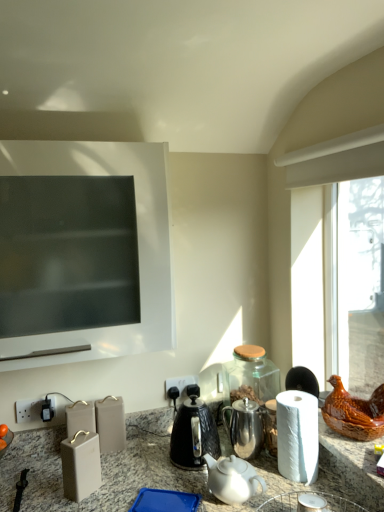
Measure the distance between white ceramic teapot at center and camera.

white ceramic teapot at center is 4.27 feet away from camera.

In order to click on matte gray knife block at center in this screenshot , I will do `click(81, 465)`.

Describe the element at coordinates (81, 465) in the screenshot. I see `matte gray knife block at center` at that location.

You are a GUI agent. You are given a task and a screenshot of the screen. Output one action in this format:
    pyautogui.click(x=<x>, y=<y>)
    Task: Click on the black textured kettle at center
    Image resolution: width=384 pixels, height=512 pixels.
    Given the screenshot: What is the action you would take?
    pyautogui.click(x=192, y=431)

This screenshot has width=384, height=512. What are the coordinates of `white paper at right` in the screenshot? It's located at (297, 436).

This screenshot has height=512, width=384. Describe the element at coordinates (297, 436) in the screenshot. I see `white paper at right` at that location.

Where is `shiny metallic teapot at center`? The image size is (384, 512). shiny metallic teapot at center is located at coordinates 245,426.

The image size is (384, 512). Identify the location of white ceramic teapot at center. (233, 479).

Between white ceramic teapot at center and shiny metallic teapot at center, which one has smaller width?

shiny metallic teapot at center.

From a real-world perspective, is white ceramic teapot at center over shiny metallic teapot at center?

No, from a real-world perspective, white ceramic teapot at center is not above shiny metallic teapot at center.

Looking at this image, is white ceramic teapot at center far away from shiny metallic teapot at center?

No, there isn't a large distance between white ceramic teapot at center and shiny metallic teapot at center.

Is shiny metallic teapot at center thinner than white ceramic teapot at center?

Correct, the width of shiny metallic teapot at center is less than that of white ceramic teapot at center.

Are shiny metallic teapot at center and white ceramic teapot at center far apart?

shiny metallic teapot at center is near white ceramic teapot at center, not far away.

Considering the positions of point (236, 451) and point (243, 499), is point (236, 451) closer or farther from the camera than point (243, 499)?

Point (236, 451) is farther from the camera than point (243, 499).

Which object is thinner, black plastic electric outlet at lower center or matte gray knife block at center?

With smaller width is black plastic electric outlet at lower center.

Locate an element on the screen. appliance directly beneath the black plastic electric outlet at lower center (from a real-world perspective) is located at coordinates (81, 465).

Considering the relative sizes of black plastic electric outlet at lower center and matte gray knife block at center in the image provided, is black plastic electric outlet at lower center taller than matte gray knife block at center?

Incorrect, the height of black plastic electric outlet at lower center is not larger of that of matte gray knife block at center.

Could you tell me if black plastic electric outlet at lower center is turned towards matte gray knife block at center?

No.

In the scene shown: Considering the relative positions of black plastic electric outlet at lower center and black textured kettle at center in the image provided, is black plastic electric outlet at lower center behind black textured kettle at center?

Yes.

From the picture: Is black plastic electric outlet at lower center looking in the opposite direction of black textured kettle at center?

black plastic electric outlet at lower center does not have its back to black textured kettle at center.

Considering the sizes of objects black plastic electric outlet at lower center and black textured kettle at center in the image provided, who is smaller, black plastic electric outlet at lower center or black textured kettle at center?

black plastic electric outlet at lower center is smaller.

Would you consider shiny metallic teapot at center to be distant from white paper at right?

No, shiny metallic teapot at center is not far from white paper at right.

Between shiny metallic teapot at center and white paper at right, which one appears on the left side from the viewer's perspective?

shiny metallic teapot at center.

From the image's perspective, which is below, white paper at right or shiny metallic teapot at center?

shiny metallic teapot at center.

Does white paper at right touch shiny metallic teapot at center?

white paper at right and shiny metallic teapot at center are clearly separated.

Considering the relative sizes of white paper at right and shiny metallic teapot at center in the image provided, is white paper at right bigger than shiny metallic teapot at center?

Correct, white paper at right is larger in size than shiny metallic teapot at center.

Is white paper at right situated inside shiny metallic teapot at center or outside?

white paper at right is located beyond the bounds of shiny metallic teapot at center.

Is matte gray knife block at center not inside black textured kettle at center?

Yes, matte gray knife block at center is not within black textured kettle at center.

Is matte gray knife block at center positioned with its back to black textured kettle at center?

No, matte gray knife block at center's orientation is not away from black textured kettle at center.

Is the position of matte gray knife block at center less distant than that of black textured kettle at center?

Yes, it is.

Considering the relative sizes of matte gray knife block at center and black textured kettle at center in the image provided, is matte gray knife block at center taller than black textured kettle at center?

Incorrect, the height of matte gray knife block at center is not larger of that of black textured kettle at center.

Find the location of a particular element. Image resolution: width=384 pixels, height=512 pixels. tea pot that is on the right side of white ceramic teapot at center is located at coordinates (245, 426).

You are a GUI agent. You are given a task and a screenshot of the screen. Output one action in this format:
    pyautogui.click(x=<x>, y=<y>)
    Task: Click on the tea pot above the white ceramic teapot at center (from a real-world perspective)
    The width and height of the screenshot is (384, 512).
    Given the screenshot: What is the action you would take?
    pyautogui.click(x=245, y=426)

Considering their positions, is matte gray knife block at center positioned closer to black textured kettle at center than white ceramic teapot at center?

white ceramic teapot at center lies closer to black textured kettle at center than the other object.

When comparing their distances from matte gray knife block at center, does black textured kettle at center or white ceramic teapot at center seem further?

white ceramic teapot at center is further to matte gray knife block at center.

Which object lies nearer to the anchor point matte gray knife block at center, white paper at right or white ceramic teapot at center?

Among the two, white ceramic teapot at center is located nearer to matte gray knife block at center.

Looking at the image, which one is located further to white ceramic teapot at center, black textured kettle at center or shiny metallic teapot at center?

Based on the image, shiny metallic teapot at center appears to be further to white ceramic teapot at center.

From the image, which object appears to be nearer to shiny metallic teapot at center, matte gray knife block at center or black textured kettle at center?

The object closer to shiny metallic teapot at center is black textured kettle at center.

From the image, which object appears to be nearer to black textured kettle at center, shiny metallic teapot at center or matte gray knife block at center?

shiny metallic teapot at center is positioned closer to the anchor black textured kettle at center.

From the image, which object appears to be nearer to black textured kettle at center, shiny metallic teapot at center or white ceramic teapot at center?

shiny metallic teapot at center is closer to black textured kettle at center.

Considering their positions, is matte gray knife block at center positioned further to black plastic electric outlet at lower center than white ceramic teapot at center?

matte gray knife block at center lies further to black plastic electric outlet at lower center than the other object.

Find the location of a particular element. The height and width of the screenshot is (512, 384). electric outlet situated between matte gray knife block at center and white paper at right from left to right is located at coordinates pyautogui.click(x=180, y=383).

This screenshot has height=512, width=384. Identify the location of paper towel between white ceramic teapot at center and black plastic electric outlet at lower center from front to back. (297, 436).

The height and width of the screenshot is (512, 384). Identify the location of coffeepot positioned between white ceramic teapot at center and shiny metallic teapot at center from near to far. (192, 431).

Locate an element on the screen. The image size is (384, 512). coffeepot between white ceramic teapot at center and black plastic electric outlet at lower center from front to back is located at coordinates (192, 431).